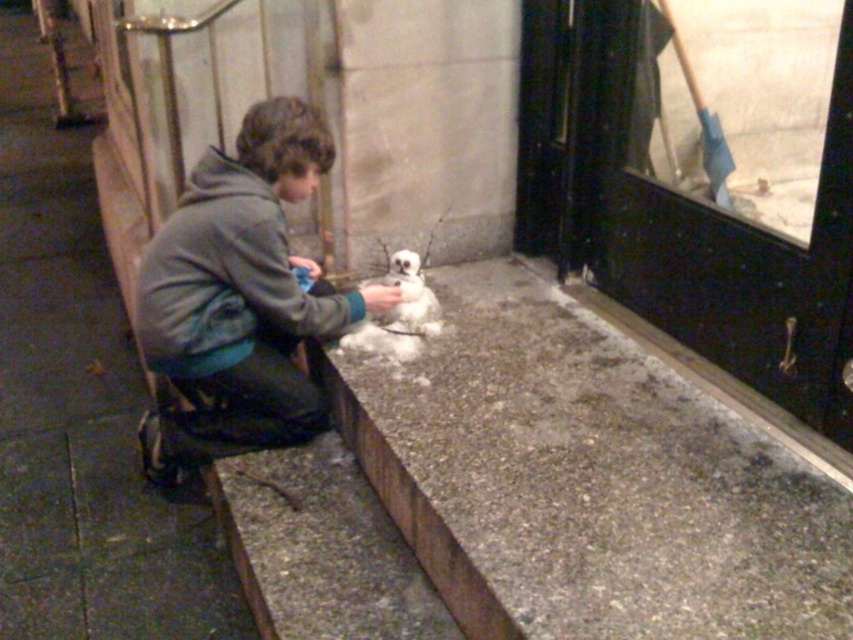
Between point (724, 538) and point (184, 435), which one is positioned in front?

Positioned in front is point (724, 538).

I want to click on granite ledge at lower center, so click(587, 481).